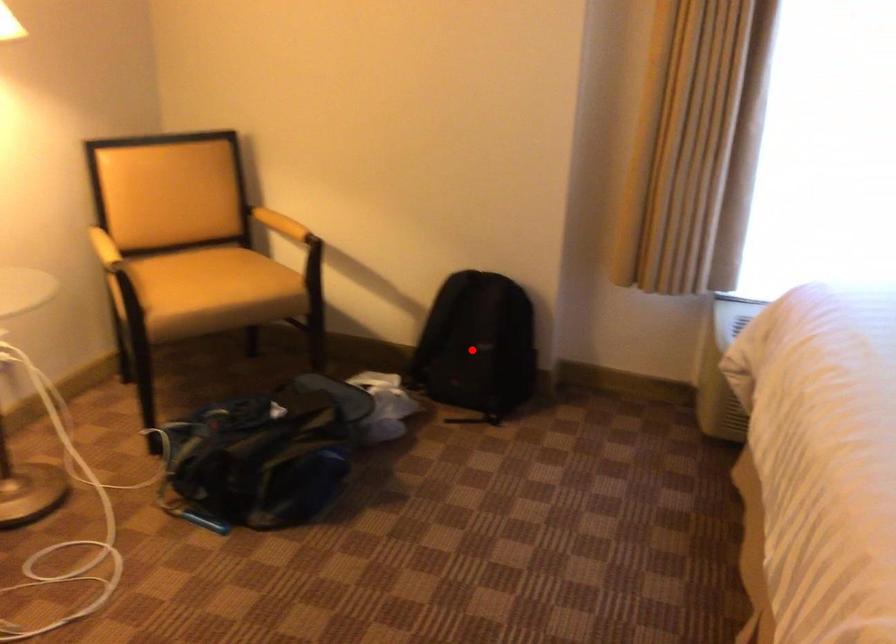
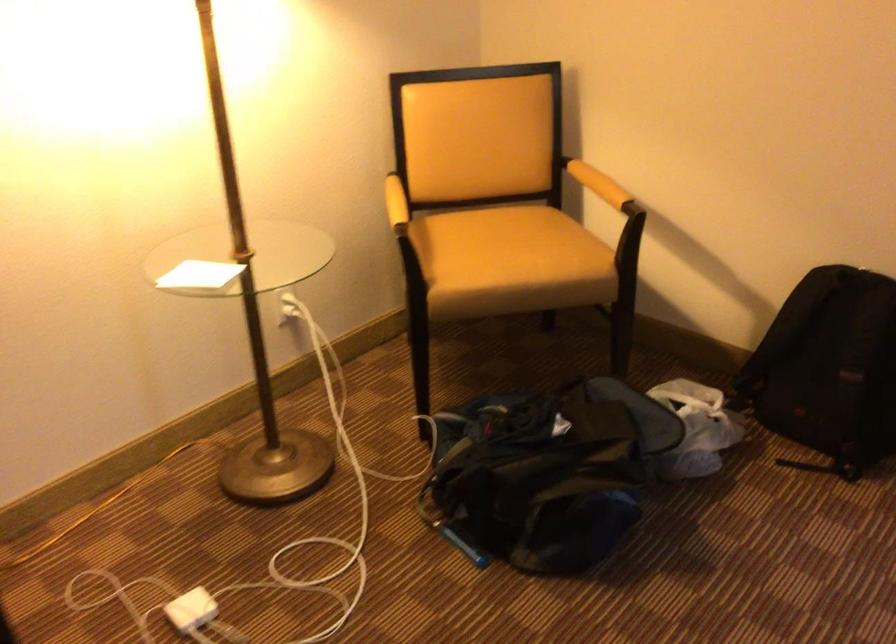
Question: A red point is marked in image1. In image2, is the corresponding 3D point closer to the camera or farther? Reply with the corresponding letter.

Choices:
 (A) The corresponding 3D point is closer.
 (B) The corresponding 3D point is farther.

Answer: (A)